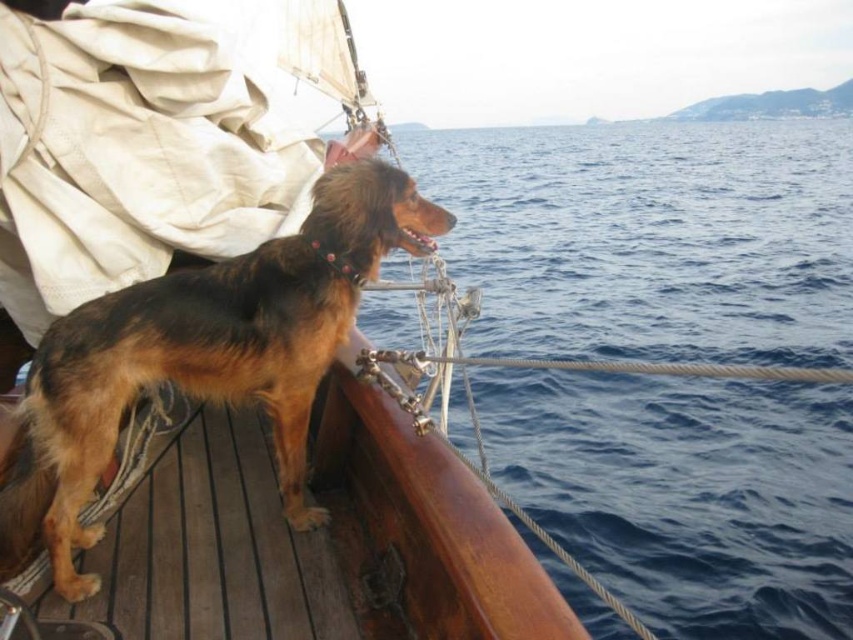
From the picture: Who is higher up, blue water at center or brown furry dog at left?

blue water at center

Does blue water at center have a greater width compared to brown furry dog at left?

Indeed, blue water at center has a greater width compared to brown furry dog at left.

Between point (686, 326) and point (141, 349), which one is positioned behind?

Point (686, 326)

Locate an element on the screen. blue water at center is located at coordinates (650, 237).